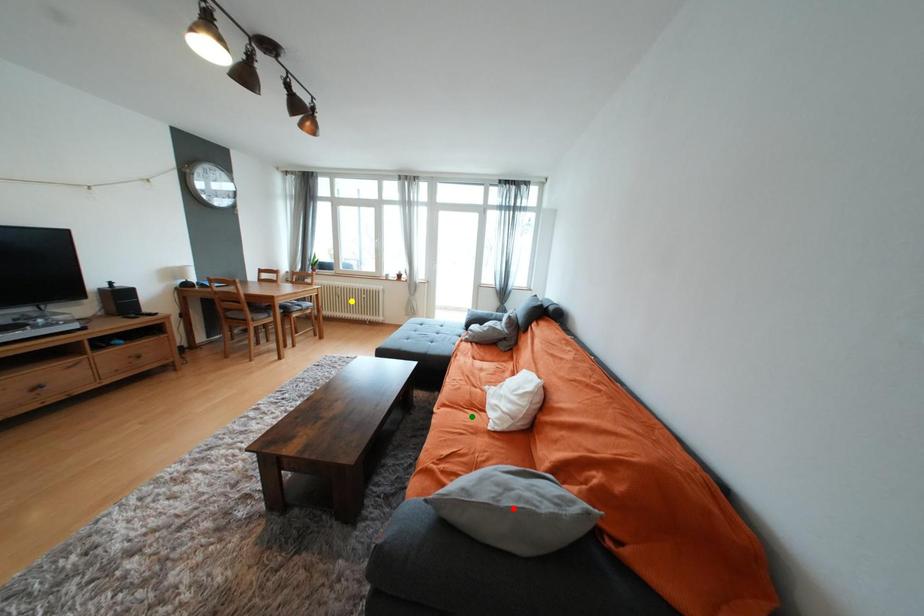
Order these from farthest to nearest:
yellow point, red point, green point

→ yellow point
green point
red point